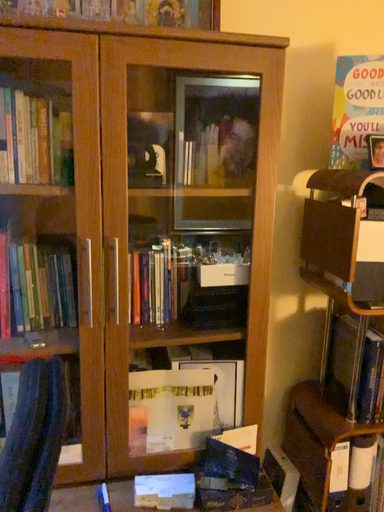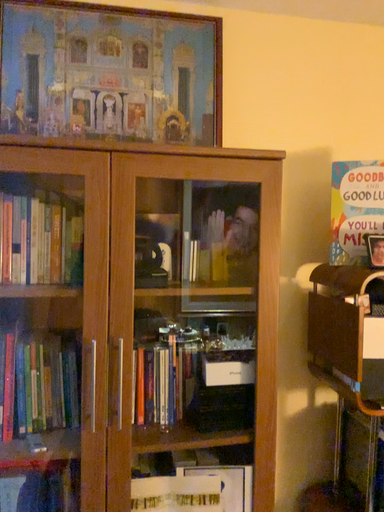
Question: Which way did the camera rotate in the video?

Choices:
 (A) rotated downward
 (B) rotated upward

Answer: (B)